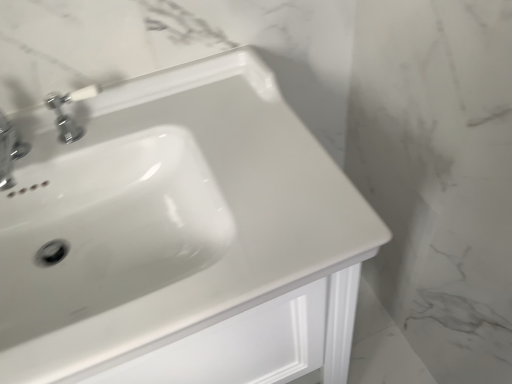
Question: Can you confirm if white glossy sink at center is wider than chrome metallic faucet at upper left, which is the second tap in left-to-right order?

Choices:
 (A) yes
 (B) no

Answer: (A)

Question: From a real-world perspective, is white glossy sink at center physically below chrome metallic faucet at upper left, the first tap when ordered from right to left?

Choices:
 (A) no
 (B) yes

Answer: (B)

Question: Considering the relative sizes of white glossy sink at center and chrome metallic faucet at upper left, the first tap when ordered from right to left, in the image provided, is white glossy sink at center bigger than chrome metallic faucet at upper left, the first tap when ordered from right to left,?

Choices:
 (A) yes
 (B) no

Answer: (A)

Question: Is white glossy sink at center to the right of chrome metallic faucet at upper left, which is the second tap in left-to-right order, from the viewer's perspective?

Choices:
 (A) no
 (B) yes

Answer: (B)

Question: Is white glossy sink at center touching chrome metallic faucet at upper left, which is the second tap in left-to-right order?

Choices:
 (A) no
 (B) yes

Answer: (A)

Question: Is white glossy sink at center looking in the opposite direction of chrome metallic faucet at upper left, which is the second tap in left-to-right order?

Choices:
 (A) no
 (B) yes

Answer: (A)

Question: Considering the relative sizes of chrome metallic faucet at upper left, the first tap when ordered from right to left, and white glossy sink at center in the image provided, is chrome metallic faucet at upper left, the first tap when ordered from right to left, shorter than white glossy sink at center?

Choices:
 (A) no
 (B) yes

Answer: (B)

Question: Is chrome metallic faucet at upper left, which is the second tap in left-to-right order, not within white glossy sink at center?

Choices:
 (A) no
 (B) yes

Answer: (A)

Question: From a real-world perspective, is chrome metallic faucet at upper left, the first tap when ordered from right to left, under white glossy sink at center?

Choices:
 (A) yes
 (B) no

Answer: (B)

Question: Is chrome metallic faucet at upper left, which is the second tap in left-to-right order, wider than white glossy sink at center?

Choices:
 (A) yes
 (B) no

Answer: (B)

Question: Considering the relative sizes of chrome metallic faucet at upper left, which is the second tap in left-to-right order, and white glossy sink at center in the image provided, is chrome metallic faucet at upper left, which is the second tap in left-to-right order, bigger than white glossy sink at center?

Choices:
 (A) yes
 (B) no

Answer: (B)

Question: Is chrome metallic faucet at upper left, the first tap when ordered from right to left, taller than white glossy sink at center?

Choices:
 (A) no
 (B) yes

Answer: (A)

Question: Is white glossy sink at center further to camera compared to chrome metallic faucet at upper left, which is the 1th tap from left to right?

Choices:
 (A) no
 (B) yes

Answer: (A)